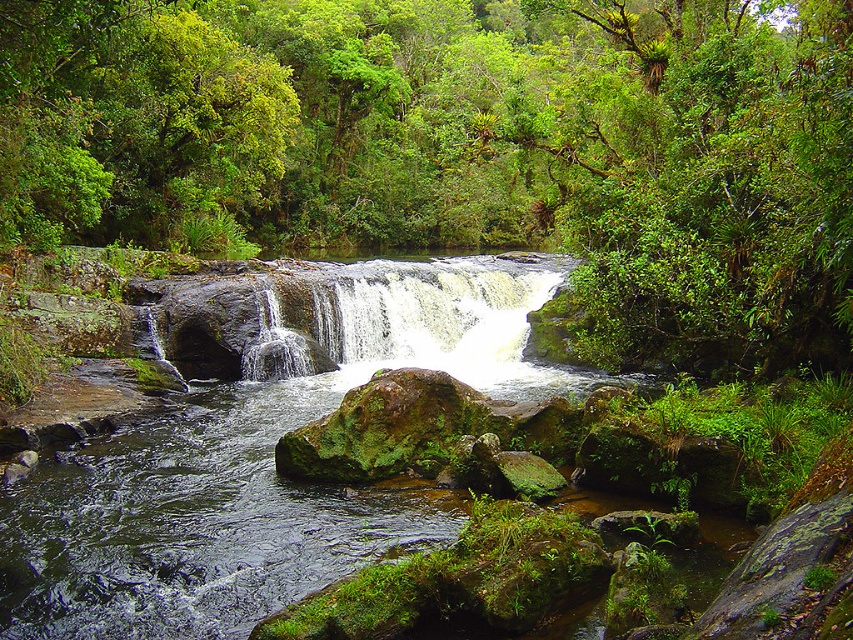
Question: Which point is farther to the camera?

Choices:
 (A) click(x=444, y=328)
 (B) click(x=672, y=269)
 (C) click(x=598, y=280)

Answer: (A)

Question: Is green leafy tree at center to the right of green leafy tree at upper center from the viewer's perspective?

Choices:
 (A) no
 (B) yes

Answer: (A)

Question: Which point is farther from the camera taking this photo?

Choices:
 (A) [30, 147]
 (B) [401, 339]

Answer: (B)

Question: Can you confirm if green leafy tree at center is positioned to the left of white frothy water at center?

Choices:
 (A) yes
 (B) no

Answer: (B)

Question: Can you confirm if green leafy tree at center is positioned above green leafy tree at upper center?

Choices:
 (A) no
 (B) yes

Answer: (B)

Question: Which of these objects is positioned closest to the green leafy tree at center?

Choices:
 (A) white frothy water at center
 (B) green leafy tree at upper center

Answer: (B)